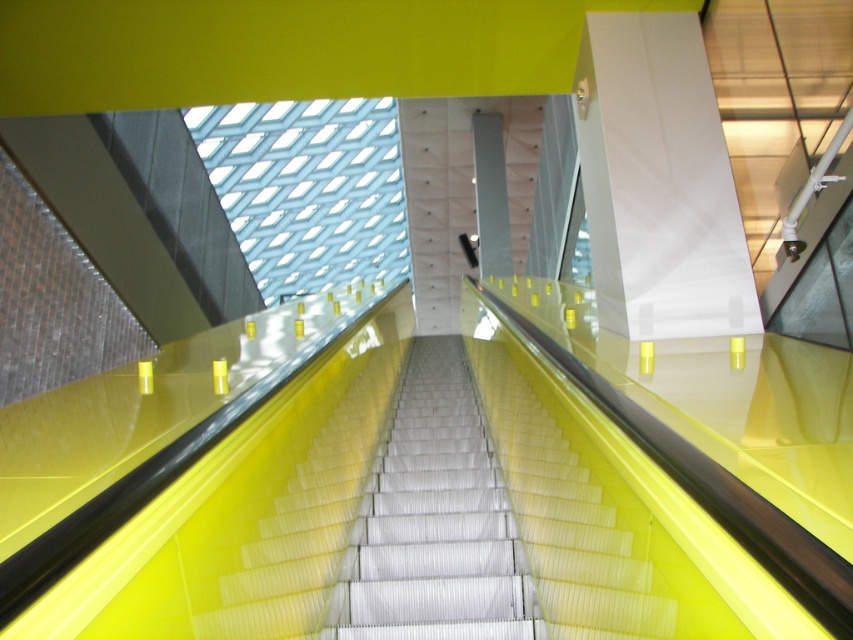
How far apart are white glossy stairs at center and yellow glossy stairs at center?

The distance of white glossy stairs at center from yellow glossy stairs at center is 4.87 feet.

What do you see at coordinates (438, 520) in the screenshot? I see `white glossy stairs at center` at bounding box center [438, 520].

Locate an element on the screen. This screenshot has width=853, height=640. white glossy stairs at center is located at coordinates (x=438, y=520).